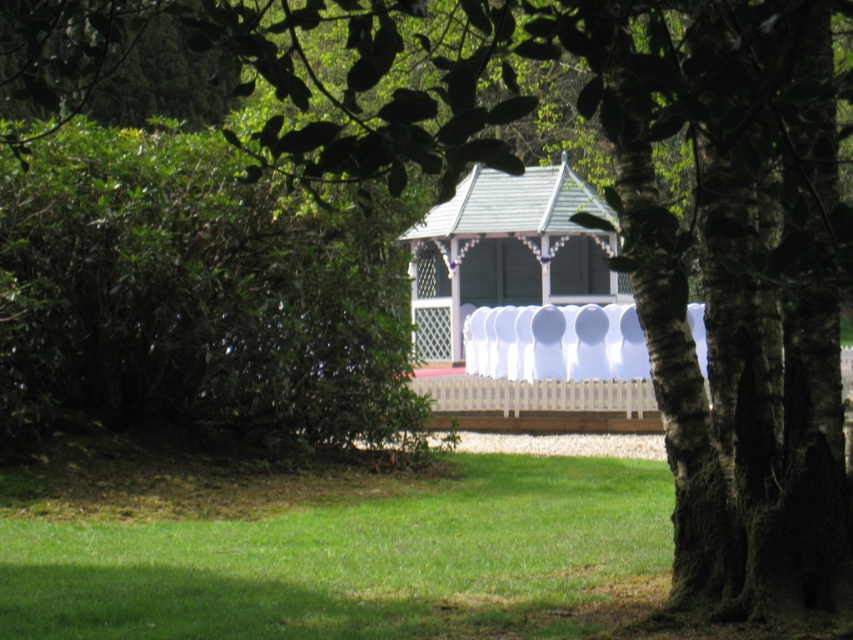
You are standing at point (509, 268) and want to walk to point (547, 493). Is there a clear path between these two points?

Yes, there is a clear path between point (547, 493) and point (509, 268) because point (547, 493) is in front of point (509, 268), indicating they are aligned along the same line of sight without obstruction.

You are planning to set up a picnic in the garden. You have a large picnic blanket that can cover an area equal to the size of the white wood gazebo at center. Will the green grass at lower center be completely covered by the blanket?

The green grass at lower center is smaller than the white wood gazebo at center. Since the picnic blanket can cover the gazebo size, it will be large enough to completely cover the green grass at lower center.

You are planning to set up a picnic in the garden. You have a large picnic blanket that can cover an area wider than the white wood gazebo at center. Can the green grass at lower center accommodate your blanket?

The green grass at lower center has a larger width than the white wood gazebo at center, so yes, the picnic blanket can be placed on the green grass at lower center as it is wider than the gazebo.